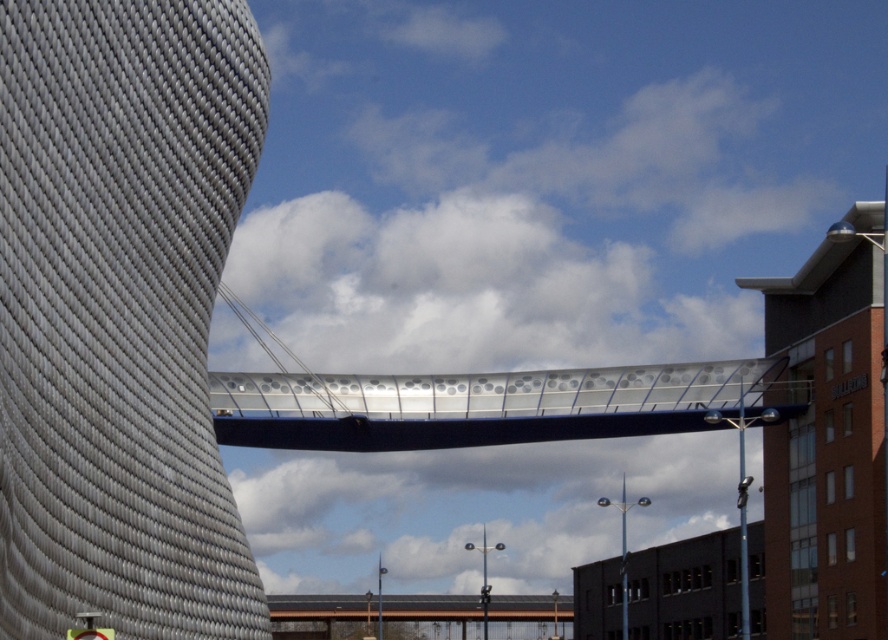
Question: Can you confirm if textured gray tower at center is positioned to the right of metallic gray pedestrian bridge at center?

Choices:
 (A) no
 (B) yes

Answer: (A)

Question: Which object appears farthest from the camera in this image?

Choices:
 (A) brick building at right
 (B) textured gray tower at center
 (C) metallic silver pedestrian bridge at center
 (D) metallic gray pedestrian bridge at center

Answer: (D)

Question: Can you confirm if textured gray tower at center is positioned to the right of metallic gray pedestrian bridge at center?

Choices:
 (A) yes
 (B) no

Answer: (B)

Question: Which point appears closest to the camera in this image?

Choices:
 (A) (207, 566)
 (B) (882, 410)
 (C) (387, 595)
 (D) (601, 413)

Answer: (A)

Question: Does brick building at right have a lesser width compared to metallic silver pedestrian bridge at center?

Choices:
 (A) yes
 (B) no

Answer: (A)

Question: Which object appears farthest from the camera in this image?

Choices:
 (A) metallic gray pedestrian bridge at center
 (B) brick building at right
 (C) textured gray tower at center
 (D) metallic silver pedestrian bridge at center

Answer: (A)